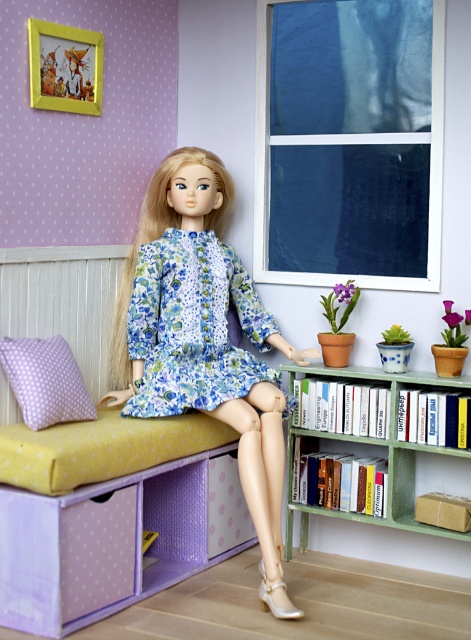
You are a dollhouse designer who wants to add a new shelf to the storage unit. The new shelf must be placed above the floral fabric dress at center so it doesn not block the view of the dress. Can the green matte bookcase at lower right be placed below the new shelf without overlapping?

The floral fabric dress at center has a lesser height compared to the green matte bookcase at lower right. Since the new shelf is placed above the dress, the bookcase at lower right is already positioned below the dress and the new shelf would be above both, so there would be no overlap between the green matte bookcase at lower right and the new shelf.